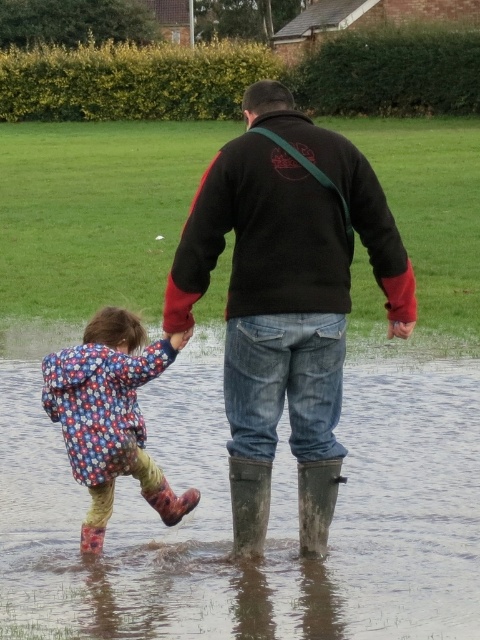
You are a photographer trying to capture both the dark brown leather jacket at center and the black fleece sweatshirt at center in the same frame. Based on their positions, which one is closer to the camera?

The dark brown leather jacket at center is closer to the camera because it is in front of the black fleece sweatshirt at center.